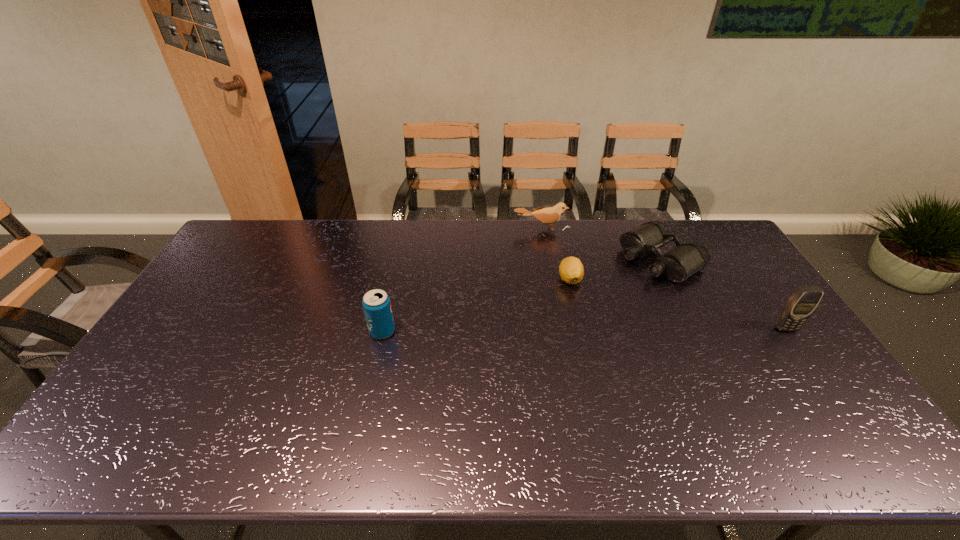
Identify the location of free point between the bird and the leftmost object. (462, 280).

Locate an element on the screen. vacant space that is in between the farthest object and the rightmost object is located at coordinates (663, 279).

Image resolution: width=960 pixels, height=540 pixels. I want to click on vacant region between the leftmost object and the second shortest object, so click(521, 295).

Locate an element on the screen. The image size is (960, 540). blank region between the farthest object and the cellular telephone is located at coordinates (663, 279).

The width and height of the screenshot is (960, 540). Find the location of `vacant region between the cellular telephone and the shortest object`. vacant region between the cellular telephone and the shortest object is located at coordinates (678, 304).

Where is `vacant area between the fourth shortest object and the fourth tallest object`? The image size is (960, 540). vacant area between the fourth shortest object and the fourth tallest object is located at coordinates (521, 295).

At what (x,y) coordinates should I click in order to perform the action: click on free space between the third tallest object and the fourth shortest object. Please return your answer as a coordinate pair (x, y). Looking at the image, I should click on (462, 280).

Locate an element on the screen. This screenshot has width=960, height=540. unoccupied position between the third tallest object and the lemon is located at coordinates (556, 254).

Where is `vacant region between the rightmost object and the farthest object`? The width and height of the screenshot is (960, 540). vacant region between the rightmost object and the farthest object is located at coordinates (x=663, y=279).

Identify which object is the second closest to the second object from right to left. Please provide its 2D coordinates. Your answer should be formatted as a tuple, i.e. [(x, y)], where the tuple contains the x and y coordinates of a point satisfying the conditions above.

[(571, 270)]